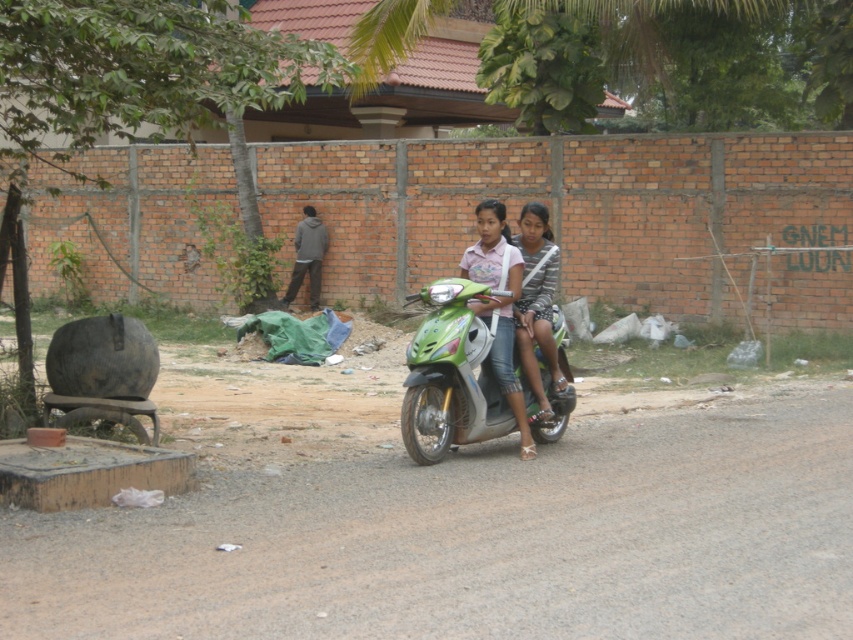
You are a photographer trying to capture a photo of the green glossy scooter at center and the striped fabric dress at center. Based on their positions, which object should you focus on first to ensure both are in the frame?

The green glossy scooter at center is located below the striped fabric dress at center, so you should focus on the striped fabric dress at center first to ensure both are in the frame.

You are planning to place a 2 meter wide picnic blanket on the dirt track at lower center and the striped fabric dress at center. Which location can accommodate the picnic blanket without folding?

The dirt track at lower center can accommodate the picnic blanket without folding because its width is larger than the striped fabric dress at center.

You are a photographer trying to capture a photo of the pink fabric shirt at center and the striped fabric dress at center. Since you want to ensure both are fully visible, which one should you focus on first to avoid cropping the top of the image?

The pink fabric shirt at center is taller than the striped fabric dress at center, so you should focus on ensuring the pink fabric shirt at center is fully visible at the top to avoid cropping.